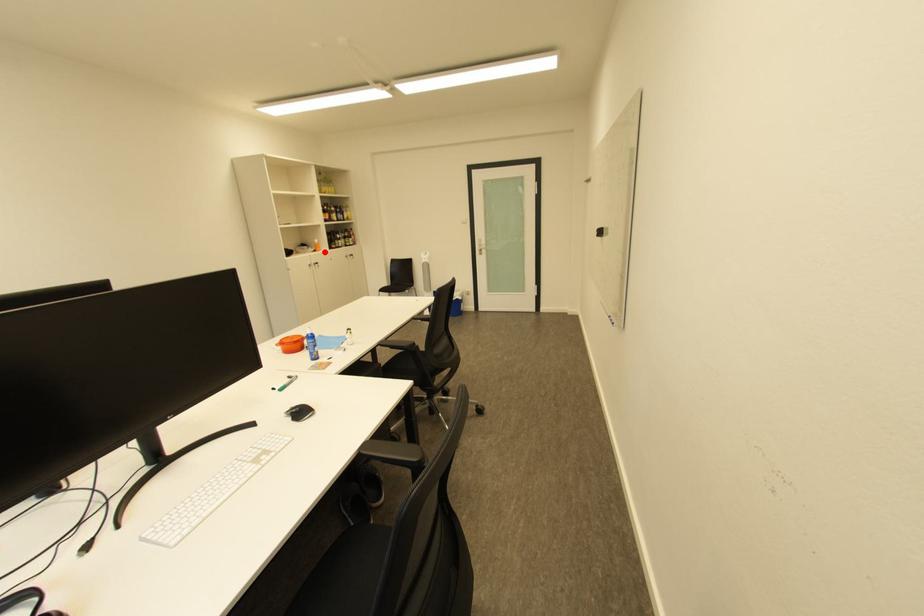
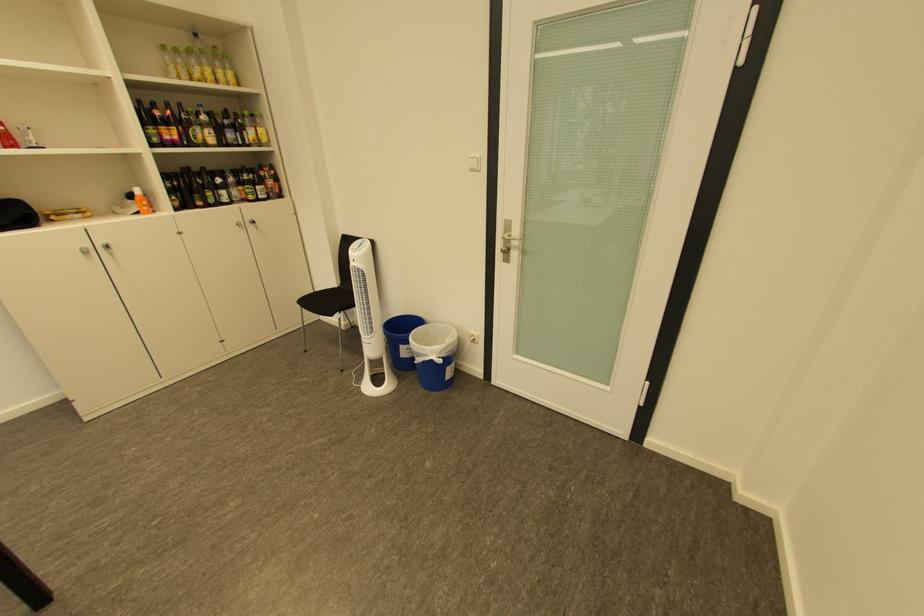
Question: I am providing you with two images of the same scene from different viewpoints. A red point is marked on the first image. At the location where the point appears in image 1, is it still visible in image 2?

Choices:
 (A) Yes
 (B) No

Answer: (A)